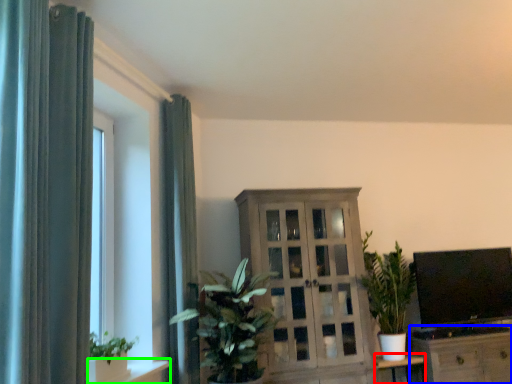
Question: Which object is the farthest from table (highlighted by a red box)? Choose among these: cabinetry (highlighted by a blue box) or shelf (highlighted by a green box).

Choices:
 (A) cabinetry
 (B) shelf

Answer: (B)